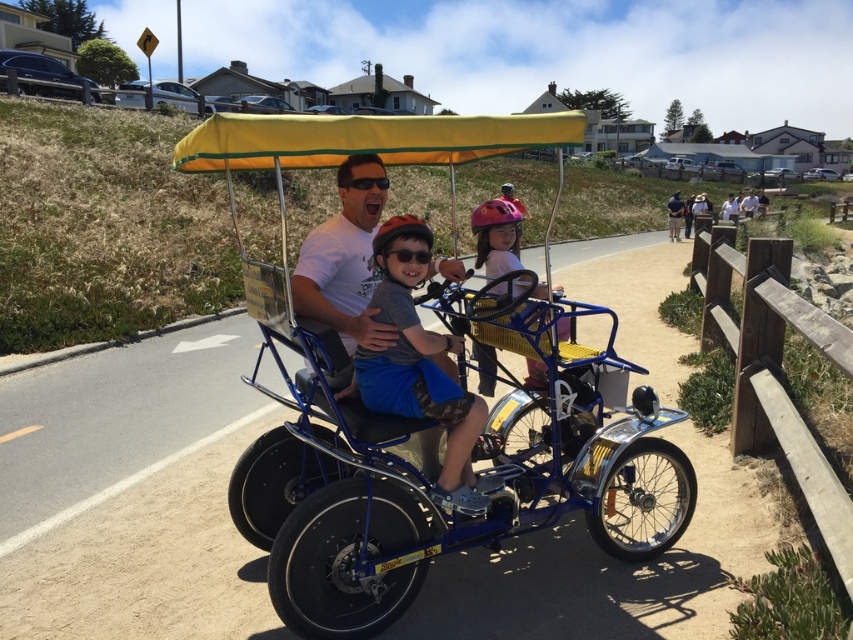
Does point (543, 134) lie in front of point (508, 244)?

Yes.

Between point (573, 134) and point (485, 216), which one is positioned in front?

Point (573, 134) is more forward.

Which is in front, point (608, 435) or point (531, 384)?

Positioned in front is point (608, 435).

Identify the location of blue metallic golf cart at center. The width and height of the screenshot is (853, 640). (428, 404).

Between point (320, 252) and point (473, 348), which one is positioned behind?

Positioned behind is point (473, 348).

Does matte blue tricycle at center have a lesser width compared to pink matte helmet at center?

In fact, matte blue tricycle at center might be wider than pink matte helmet at center.

Which is in front, point (291, 285) or point (556, 285)?

Point (291, 285) is in front.

This screenshot has height=640, width=853. Identify the location of matte blue tricycle at center. (346, 260).

Which is in front, point (387, 289) or point (357, 198)?

Positioned in front is point (387, 289).

Does matte blue shorts at center appear on the left side of matte blue tricycle at center?

In fact, matte blue shorts at center is to the right of matte blue tricycle at center.

Who is more distant from viewer, (399, 376) or (366, 292)?

The point (366, 292) is behind.

Image resolution: width=853 pixels, height=640 pixels. What are the coordinates of `matte blue shorts at center` in the screenshot? It's located at (416, 358).